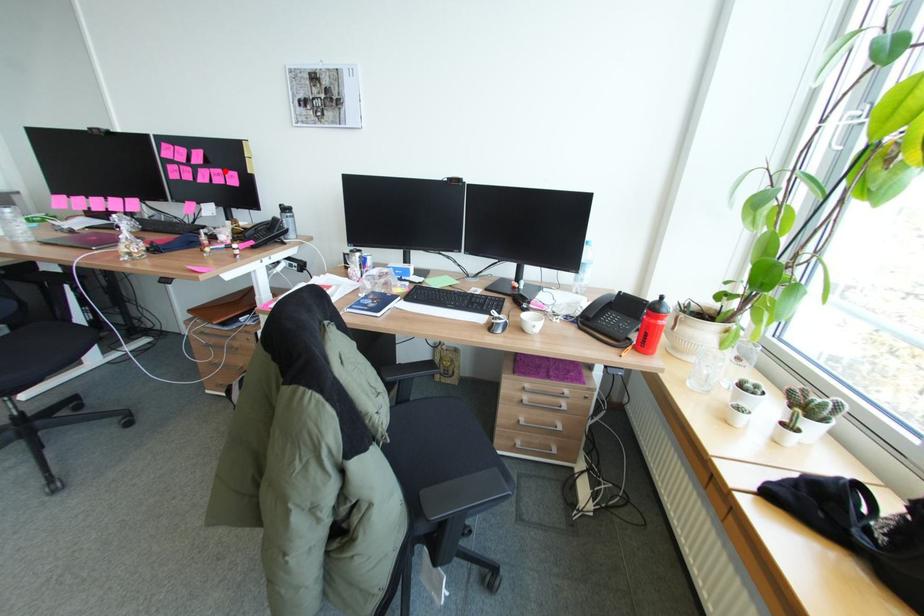
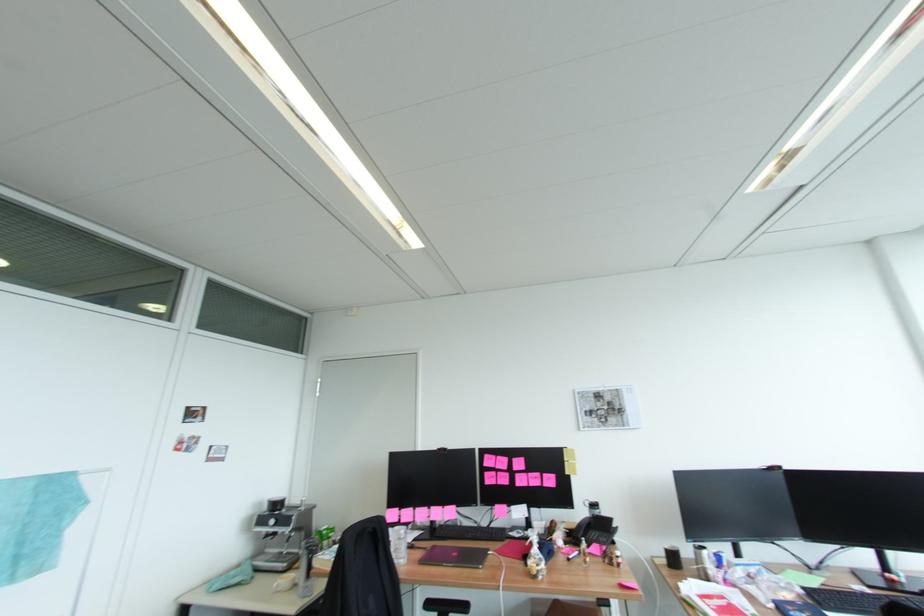
The point at the highlighted location is marked in the first image. Where is the corresponding point in the second image?

(542, 474)